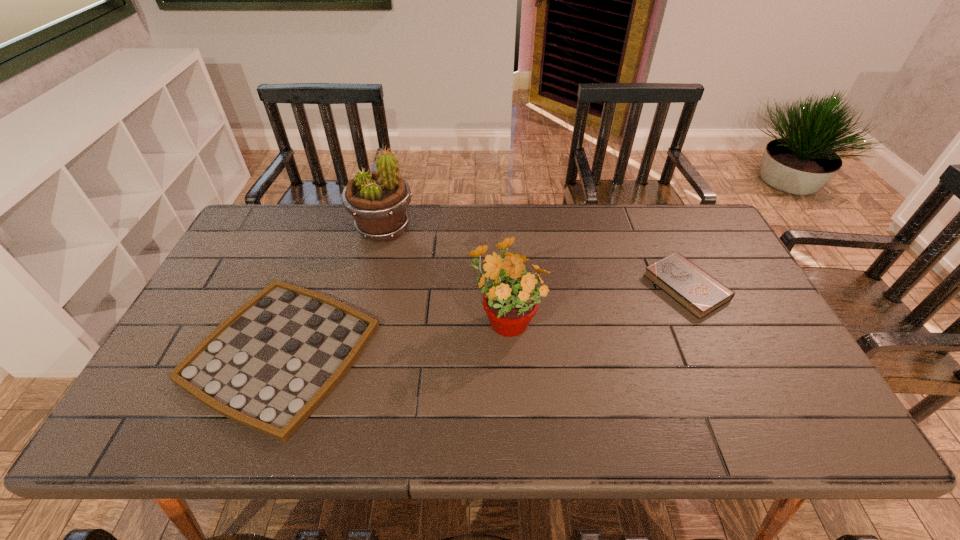
This screenshot has width=960, height=540. I want to click on empty space that is in between the nearer flowerpot and the Bible, so click(x=596, y=302).

Identify which object is the nearest to the shortest object. Please provide its 2D coordinates. Your answer should be formatted as a tuple, i.e. [(x, y)], where the tuple contains the x and y coordinates of a point satisfying the conditions above.

[(377, 200)]

The width and height of the screenshot is (960, 540). Find the location of `object that stands as the closest to the nearer flowerpot`. object that stands as the closest to the nearer flowerpot is located at coordinates (268, 366).

Locate an element on the screen. Image resolution: width=960 pixels, height=540 pixels. free space that satisfies the following two spatial constraints: 1. on the front side of the farthest object; 2. on the right side of the second shortest object is located at coordinates (370, 287).

At what (x,y) coordinates should I click in order to perform the action: click on free location that satisfies the following two spatial constraints: 1. on the front side of the farthest object; 2. on the left side of the second object from right to left. Please return your answer as a coordinate pair (x, y). The width and height of the screenshot is (960, 540). Looking at the image, I should click on (362, 317).

Find the location of a particular element. The height and width of the screenshot is (540, 960). vacant space that satisfies the following two spatial constraints: 1. on the back side of the checkerboard; 2. on the right side of the Bible is located at coordinates (306, 287).

The width and height of the screenshot is (960, 540). I want to click on vacant space that satisfies the following two spatial constraints: 1. on the back side of the farthest object; 2. on the left side of the shortest object, so 328,230.

Locate an element on the screen. vacant space that satisfies the following two spatial constraints: 1. on the back side of the third object from left to right; 2. on the right side of the rightmost object is located at coordinates (504, 287).

You are a GUI agent. You are given a task and a screenshot of the screen. Output one action in this format:
    pyautogui.click(x=<x>, y=<y>)
    Task: Click on the vacant region that satisfies the following two spatial constraints: 1. on the back side of the farthest object; 2. on the right side of the checkerboard
    The image size is (960, 540).
    Given the screenshot: What is the action you would take?
    pyautogui.click(x=328, y=230)